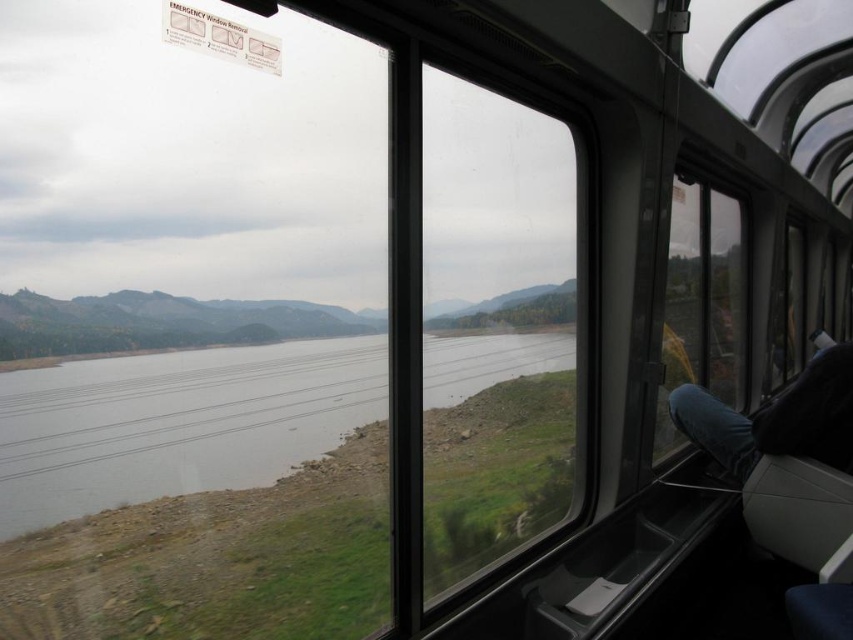
Who is shorter, gray water at center or jeans at right?

Standing shorter between the two is gray water at center.

Does gray water at center have a lesser height compared to jeans at right?

Indeed, gray water at center has a lesser height compared to jeans at right.

What do you see at coordinates (177, 422) in the screenshot?
I see `gray water at center` at bounding box center [177, 422].

At what (x,y) coordinates should I click in order to perform the action: click on gray water at center. Please return your answer as a coordinate pair (x, y). This screenshot has height=640, width=853. Looking at the image, I should click on (177, 422).